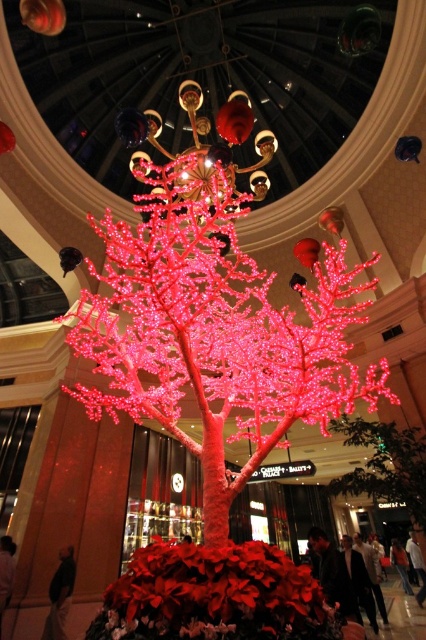
You are standing in the festive indoor setting and want to determine which of the two points, point (221, 262) or point (250, 195), is closer to you. Based on the spatial arrangement, which point is nearer?

Point (221, 262) is further to the viewer than point (250, 195), so the closer point to you is point (250, 195).

You are a maintenance worker needing to reach the gold metallic chandelier at upper center from the illuminated plastic tree at center. Given that your ladder can extend up to 20 feet, will you be able to reach the chandelier?

The distance between the illuminated plastic tree at center and the gold metallic chandelier at upper center is 21.99 feet, which is slightly longer than the ladder can reach. Therefore, you will not be able to reach the chandelier with the current ladder.